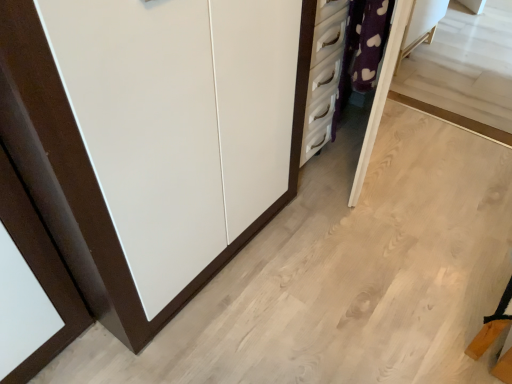
Question: Based on their sizes in the image, would you say white matte cupboard at left is bigger or smaller than purple fabric vanity at upper right?

Choices:
 (A) small
 (B) big

Answer: (B)

Question: From their relative heights in the image, would you say white matte cupboard at left is taller or shorter than purple fabric vanity at upper right?

Choices:
 (A) short
 (B) tall

Answer: (A)

Question: Is white matte cupboard at left spatially inside purple fabric vanity at upper right, or outside of it?

Choices:
 (A) outside
 (B) inside

Answer: (A)

Question: Would you say purple fabric vanity at upper right is to the left or to the right of white matte cupboard at left in the picture?

Choices:
 (A) right
 (B) left

Answer: (A)

Question: From the image's perspective, is purple fabric vanity at upper right located above or below white matte cupboard at left?

Choices:
 (A) above
 (B) below

Answer: (A)

Question: Would you say purple fabric vanity at upper right is inside or outside white matte cupboard at left?

Choices:
 (A) inside
 (B) outside

Answer: (B)

Question: Is purple fabric vanity at upper right taller or shorter than white matte cupboard at left?

Choices:
 (A) short
 (B) tall

Answer: (B)